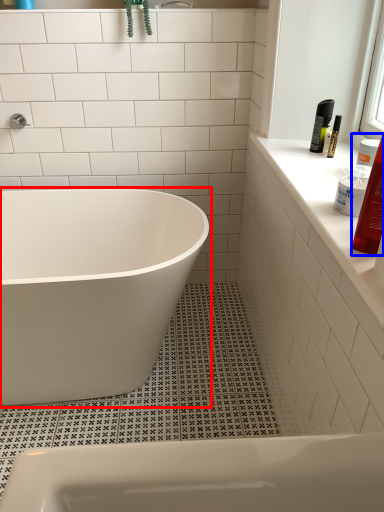
Question: Among these objects, which one is farthest to the camera, bathtub (highlighted by a red box) or toiletry (highlighted by a blue box)?

Choices:
 (A) bathtub
 (B) toiletry

Answer: (A)